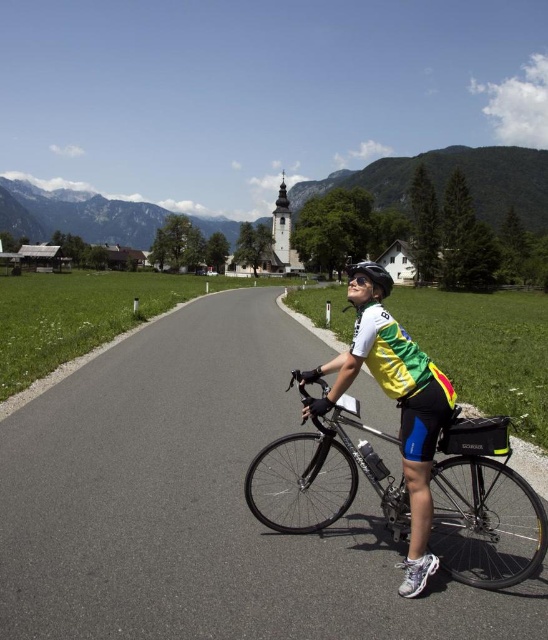
Question: Which point is farther to the camera?

Choices:
 (A) yellow/reflective fabric cyclist at center
 (B) shiny black bicycle at center
 (C) matte black helmet at center

Answer: (C)

Question: Observing the image, what is the correct spatial positioning of yellow/reflective fabric cyclist at center in reference to shiny black bicycle at center?

Choices:
 (A) right
 (B) left

Answer: (A)

Question: Is yellow/reflective fabric cyclist at center to the left of matte black helmet at center from the viewer's perspective?

Choices:
 (A) yes
 (B) no

Answer: (A)

Question: Is yellow/reflective fabric cyclist at center below matte black helmet at center?

Choices:
 (A) no
 (B) yes

Answer: (B)

Question: Which point is farther to the camera?

Choices:
 (A) shiny black bicycle at center
 (B) matte black helmet at center

Answer: (B)

Question: Among these points, which one is farthest from the camera?

Choices:
 (A) (413, 342)
 (B) (465, 426)

Answer: (A)